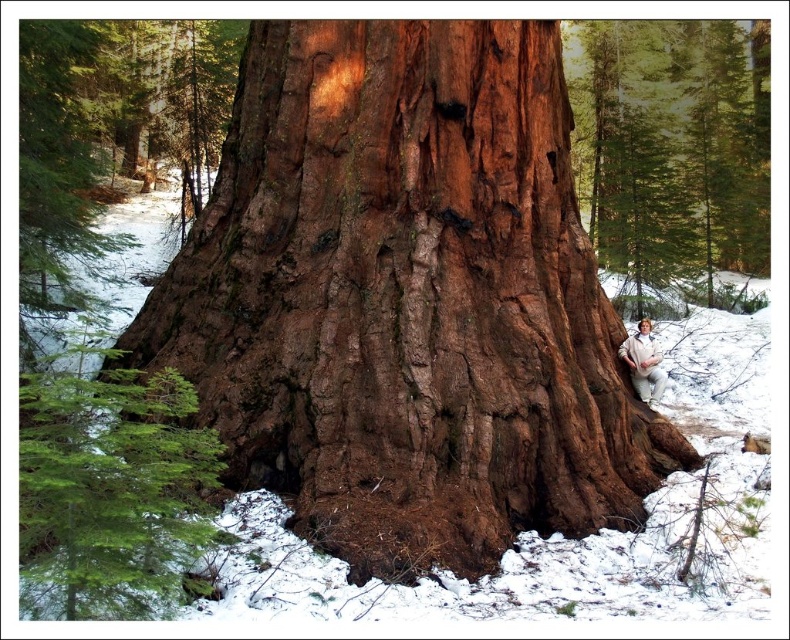
Question: Can you confirm if brown rough bark at center is positioned to the left of green matte evergreen branch at left?

Choices:
 (A) no
 (B) yes

Answer: (A)

Question: Which point appears farthest from the camera in this image?

Choices:
 (A) (260, 232)
 (B) (735, 212)
 (C) (660, 387)

Answer: (B)

Question: Is brown rough bark at lower right positioned before green matte evergreen branch at left?

Choices:
 (A) no
 (B) yes

Answer: (A)

Question: Does green matte evergreen branch at left appear on the right side of white cotton pants at lower right?

Choices:
 (A) no
 (B) yes

Answer: (A)

Question: Which point appears closest to the camera in this image?

Choices:
 (A) (649, 369)
 (B) (301, 129)

Answer: (B)

Question: Which object is farther from the camera taking this photo?

Choices:
 (A) green matte evergreen branch at left
 (B) brown rough bark at lower right
 (C) brown rough bark at center

Answer: (B)